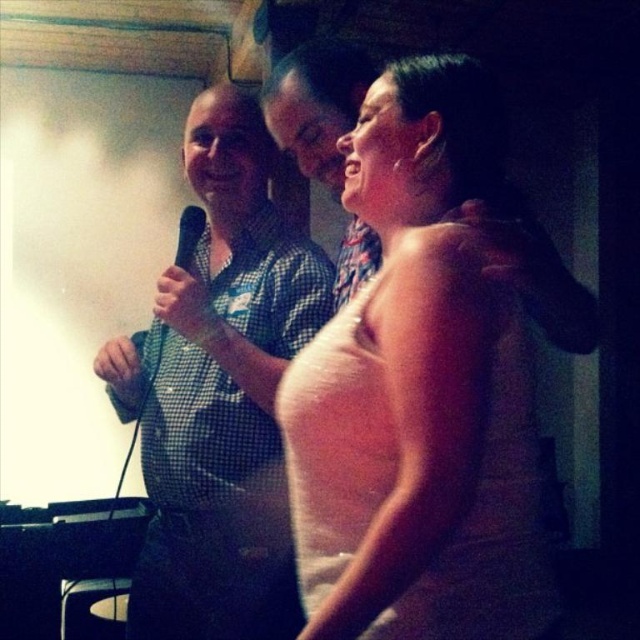
Question: Does pink satin dress at center have a lesser width compared to black matte microphone at center?

Choices:
 (A) no
 (B) yes

Answer: (A)

Question: Which object is farther from the camera taking this photo?

Choices:
 (A) black matte microphone at center
 (B) pink satin dress at center
 (C) checkered fabric shirt at left

Answer: (A)

Question: Which of these objects is positioned closest to the checkered fabric shirt at left?

Choices:
 (A) pink satin dress at center
 (B) black matte microphone at center

Answer: (B)

Question: Can you confirm if pink satin dress at center is positioned below checkered fabric shirt at left?

Choices:
 (A) yes
 (B) no

Answer: (B)

Question: Which point appears closest to the camera in this image?

Choices:
 (A) (204, 624)
 (B) (179, 227)
 (C) (513, 348)

Answer: (C)

Question: Does checkered fabric shirt at left have a greater width compared to black matte microphone at center?

Choices:
 (A) no
 (B) yes

Answer: (B)